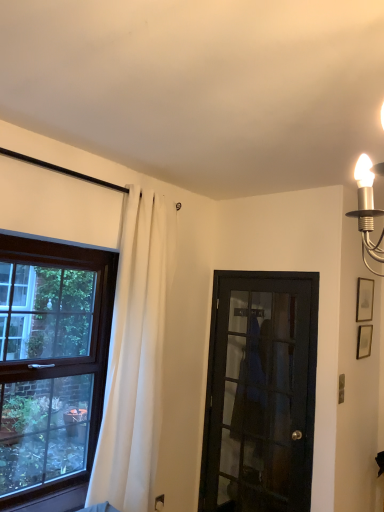
Question: Is the depth of white fabric curtain at left less than that of matte gold picture frame at upper right, positioned as the 2th picture frame in bottom-to-top order?

Choices:
 (A) yes
 (B) no

Answer: (A)

Question: Is white fabric curtain at left placed right next to matte gold picture frame at upper right, marked as the first picture frame in a top-to-bottom arrangement?

Choices:
 (A) no
 (B) yes

Answer: (A)

Question: From a real-world perspective, is white fabric curtain at left below matte gold picture frame at upper right, marked as the first picture frame in a top-to-bottom arrangement?

Choices:
 (A) no
 (B) yes

Answer: (B)

Question: Does white fabric curtain at left lie behind matte gold picture frame at upper right, positioned as the 2th picture frame in bottom-to-top order?

Choices:
 (A) yes
 (B) no

Answer: (B)

Question: Could matte gold picture frame at upper right, marked as the first picture frame in a top-to-bottom arrangement, be considered to be inside white fabric curtain at left?

Choices:
 (A) no
 (B) yes

Answer: (A)

Question: From their relative heights in the image, would you say matte gold picture frame at upper right, positioned as the 2th picture frame in bottom-to-top order, is taller or shorter than matte silver picture frame at upper right, the second picture frame from the top?

Choices:
 (A) tall
 (B) short

Answer: (A)

Question: Considering their positions, is matte gold picture frame at upper right, positioned as the 2th picture frame in bottom-to-top order, located in front of or behind matte silver picture frame at upper right, the first picture frame ordered from the bottom?

Choices:
 (A) front
 (B) behind

Answer: (B)

Question: Considering the positions of point (372, 286) and point (370, 334), is point (372, 286) closer or farther from the camera than point (370, 334)?

Choices:
 (A) closer
 (B) farther

Answer: (A)

Question: In the image, is matte gold picture frame at upper right, positioned as the 2th picture frame in bottom-to-top order, on the left side or the right side of matte silver picture frame at upper right, the first picture frame ordered from the bottom?

Choices:
 (A) right
 (B) left

Answer: (A)

Question: From their relative heights in the image, would you say white fabric curtain at left is taller or shorter than matte gold picture frame at upper right, positioned as the 2th picture frame in bottom-to-top order?

Choices:
 (A) tall
 (B) short

Answer: (A)

Question: In terms of size, does white fabric curtain at left appear bigger or smaller than matte gold picture frame at upper right, positioned as the 2th picture frame in bottom-to-top order?

Choices:
 (A) small
 (B) big

Answer: (B)

Question: Considering their positions, is white fabric curtain at left located in front of or behind matte gold picture frame at upper right, marked as the first picture frame in a top-to-bottom arrangement?

Choices:
 (A) front
 (B) behind

Answer: (A)

Question: Is white fabric curtain at left situated inside matte gold picture frame at upper right, positioned as the 2th picture frame in bottom-to-top order, or outside?

Choices:
 (A) inside
 (B) outside

Answer: (B)

Question: Visually, is matte silver picture frame at upper right, the first picture frame ordered from the bottom, positioned to the left or to the right of brown wooden window at left?

Choices:
 (A) left
 (B) right

Answer: (B)

Question: Would you say matte silver picture frame at upper right, the first picture frame ordered from the bottom, is inside or outside brown wooden window at left?

Choices:
 (A) outside
 (B) inside

Answer: (A)